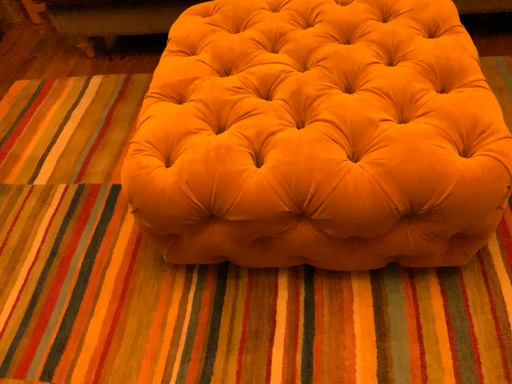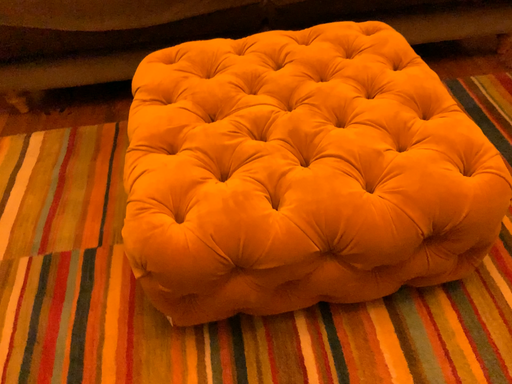
Question: How did the camera likely rotate when shooting the video?

Choices:
 (A) rotated right
 (B) rotated left

Answer: (A)